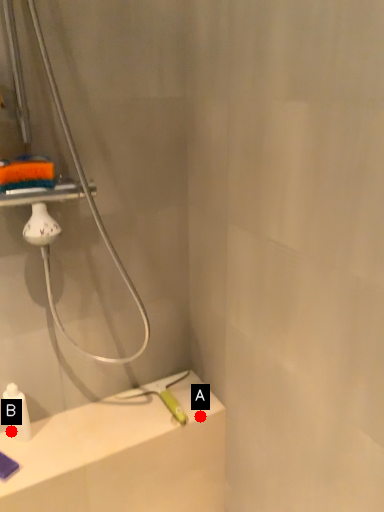
Question: Two points are circled on the image, labeled by A and B beside each circle. Which point is further to the camera?

Choices:
 (A) A is further
 (B) B is further

Answer: (A)